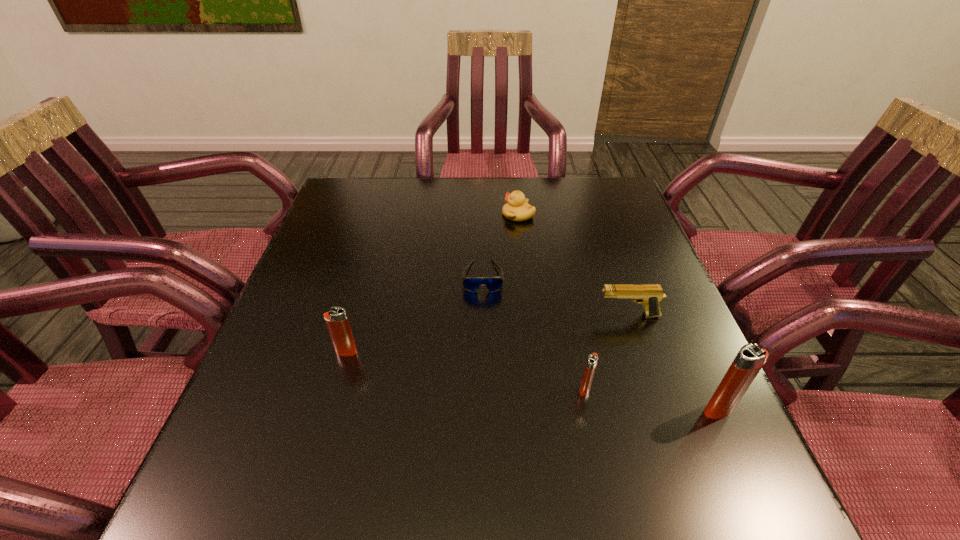
Find the location of a particular element. the second tallest object is located at coordinates point(337,322).

This screenshot has width=960, height=540. What are the coordinates of `the leftmost object` in the screenshot? It's located at [337, 322].

Identify the location of the shortest igniter. Image resolution: width=960 pixels, height=540 pixels. (592, 360).

Where is `the second igniter from right to left`? The image size is (960, 540). the second igniter from right to left is located at coordinates (592, 360).

Where is `the nearest igniter`? the nearest igniter is located at coordinates (750, 359).

Locate an element on the screen. The width and height of the screenshot is (960, 540). the nearest object is located at coordinates click(750, 359).

In order to click on the second shortest object in this screenshot , I will do `click(517, 208)`.

Image resolution: width=960 pixels, height=540 pixels. In order to click on duckling in this screenshot , I will do `click(517, 208)`.

Locate an element on the screen. The height and width of the screenshot is (540, 960). the fifth object from left to right is located at coordinates (650, 295).

Locate an element on the screen. the third farthest object is located at coordinates (650, 295).